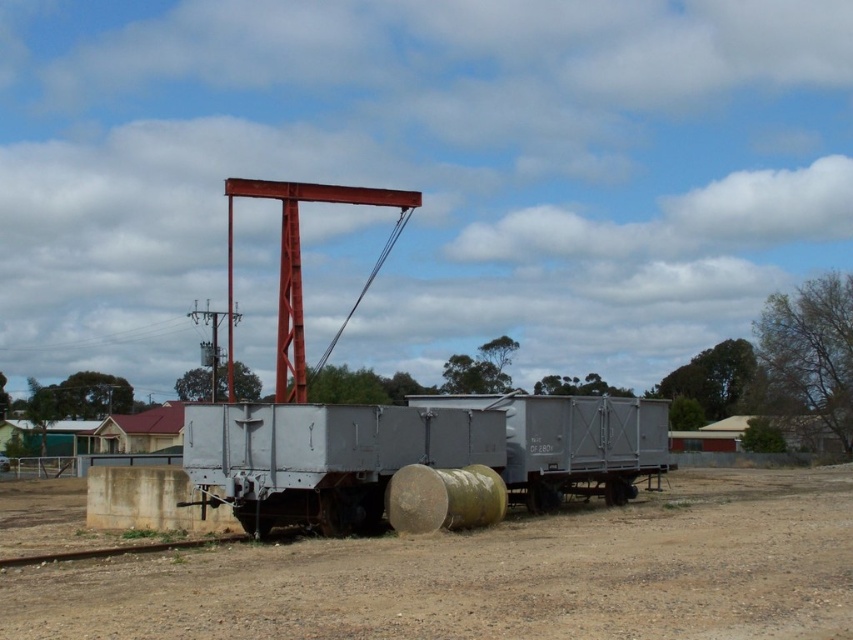
Question: Which of the following is the farthest from the observer?

Choices:
 (A) metallic gray train car at center
 (B) dull brown dirt at center

Answer: (A)

Question: Does dull brown dirt at center appear over metallic gray train car at center?

Choices:
 (A) yes
 (B) no

Answer: (B)

Question: Considering the relative positions of dull brown dirt at center and metallic gray train car at center in the image provided, where is dull brown dirt at center located with respect to metallic gray train car at center?

Choices:
 (A) above
 (B) below

Answer: (B)

Question: Which object is farther from the camera taking this photo?

Choices:
 (A) dull brown dirt at center
 (B) metallic gray train car at center

Answer: (B)

Question: From the image, what is the correct spatial relationship of dull brown dirt at center in relation to metallic gray train car at center?

Choices:
 (A) below
 (B) above

Answer: (A)